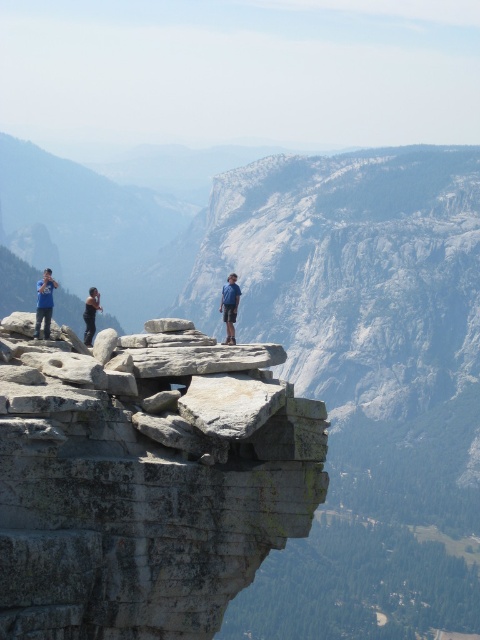
Question: Estimate the real-world distances between objects in this image. Which object is closer to the gray/weathered rock at center?

Choices:
 (A) blue denim shorts at center
 (B) matte blue shirt at left

Answer: (A)

Question: Which point is farther to the camera?

Choices:
 (A) gray/weathered rock at center
 (B) black fabric shirt at left

Answer: (B)

Question: Is matte blue shirt at left thinner than black fabric shirt at left?

Choices:
 (A) no
 (B) yes

Answer: (A)

Question: Is gray/weathered rock at center below black fabric shirt at left?

Choices:
 (A) no
 (B) yes

Answer: (B)

Question: Does gray/weathered rock at center appear on the left side of black fabric shirt at left?

Choices:
 (A) no
 (B) yes

Answer: (A)

Question: Which object is farther from the camera taking this photo?

Choices:
 (A) gray/weathered rock at center
 (B) matte blue shirt at left
 (C) black fabric shirt at left
 (D) blue denim shorts at center

Answer: (C)